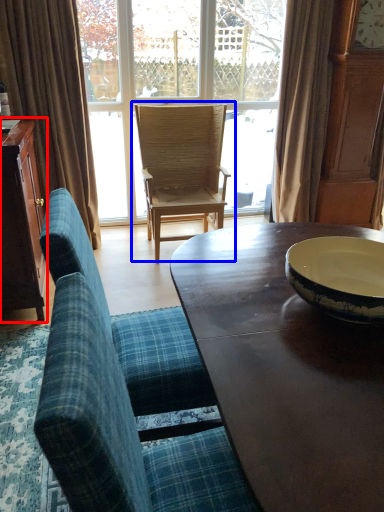
Question: Which of the following is the closest to the observer, cabinetry (highlighted by a red box) or chair (highlighted by a blue box)?

Choices:
 (A) cabinetry
 (B) chair

Answer: (A)